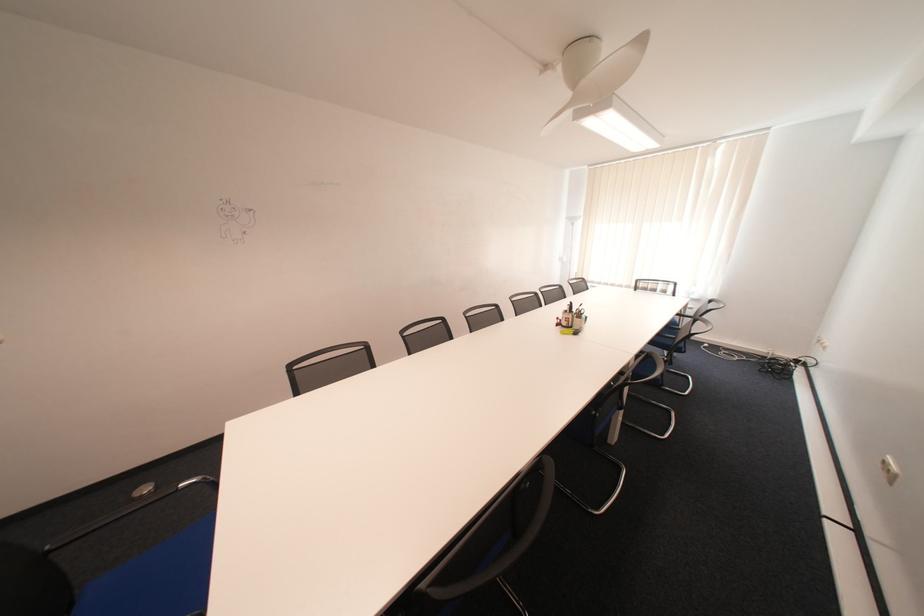
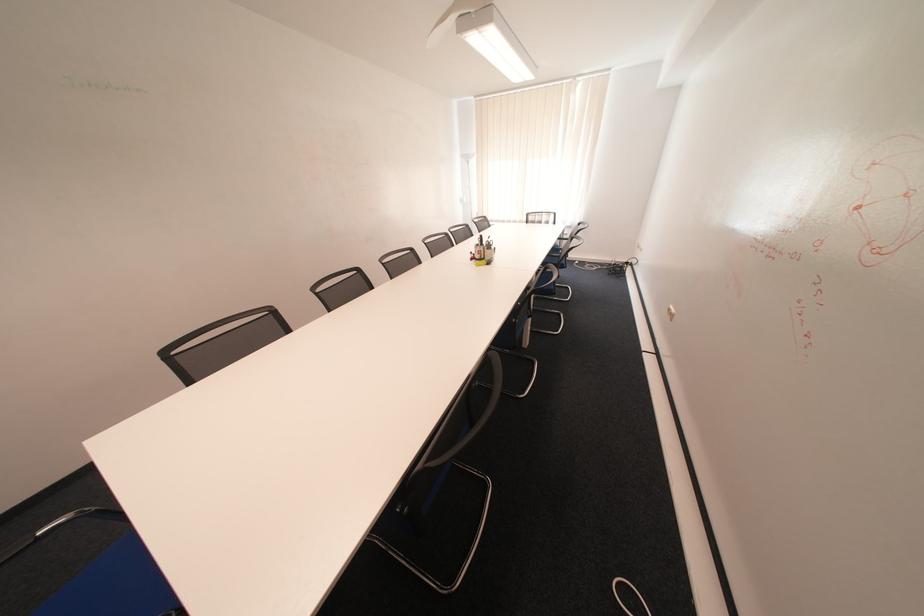
Question: The camera is either moving clockwise (left) or counter-clockwise (right) around the object. The first image is from the beginning of the video and the second image is from the end. Is the camera moving left or right when shooting the video?

Choices:
 (A) Left
 (B) Right

Answer: (A)